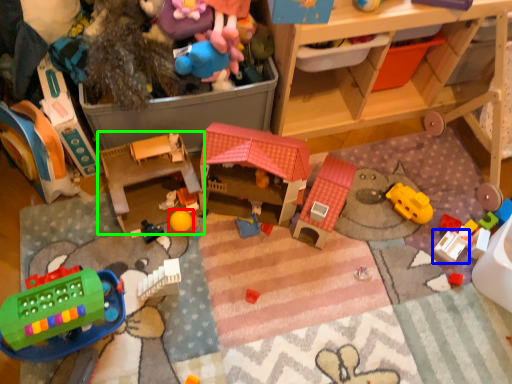
Question: Estimate the real-world distances between objects in this image. Which object is farther from toy (highlighted by a red box), toy (highlighted by a blue box) or toy (highlighted by a green box)?

Choices:
 (A) toy
 (B) toy

Answer: (A)